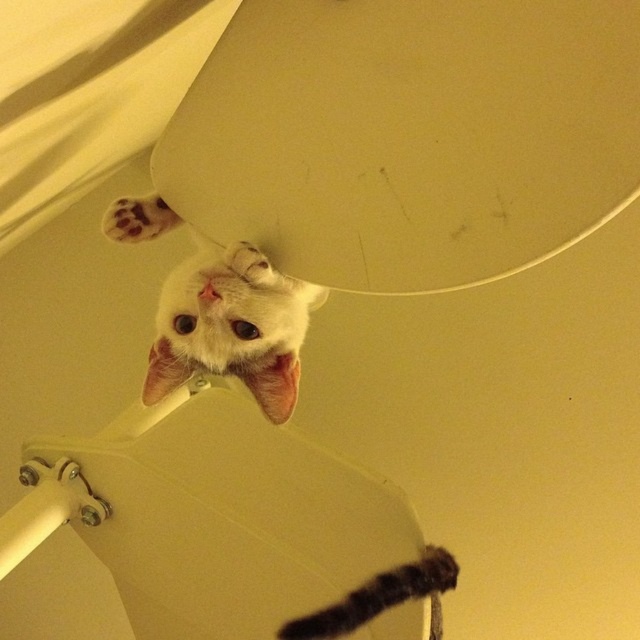
Question: Which object is closer to the camera taking this photo?

Choices:
 (A) white fur paw at upper left
 (B) white fur cat at upper center

Answer: (B)

Question: In this image, where is white fur cat at upper center located relative to white fur paw at upper left?

Choices:
 (A) left
 (B) right

Answer: (B)

Question: Observing the image, what is the correct spatial positioning of white fur cat at upper center in reference to white fur paw at upper left?

Choices:
 (A) below
 (B) above

Answer: (A)

Question: Considering the relative positions of white fur cat at upper center and white fur paw at upper left in the image provided, where is white fur cat at upper center located with respect to white fur paw at upper left?

Choices:
 (A) left
 (B) right

Answer: (B)

Question: Which of the following is the farthest from the observer?

Choices:
 (A) (124, 200)
 (B) (289, 397)

Answer: (A)

Question: Which point is farther to the camera?

Choices:
 (A) (310, 291)
 (B) (160, 225)

Answer: (A)